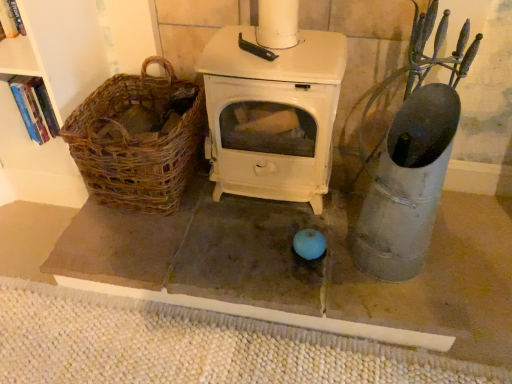
The height and width of the screenshot is (384, 512). Describe the element at coordinates (191, 346) in the screenshot. I see `woven beige mat at lower center` at that location.

What is the approximate width of woven beige mat at lower center?

1.75 meters.

Where is `woven beige mat at lower center`? woven beige mat at lower center is located at coordinates (x=191, y=346).

Describe the element at coordinates (137, 140) in the screenshot. I see `woven brown basket at left` at that location.

The height and width of the screenshot is (384, 512). I want to click on woven brown basket at left, so click(x=137, y=140).

Identify the location of woven beige mat at lower center. The width and height of the screenshot is (512, 384). (191, 346).

Is woven beige mat at lower center to the left or to the right of woven brown basket at left in the image?

From the image, it's evident that woven beige mat at lower center is to the right of woven brown basket at left.

Considering the positions of objects woven beige mat at lower center and woven brown basket at left in the image provided, who is in front, woven beige mat at lower center or woven brown basket at left?

woven beige mat at lower center.

Which is behind, point (350, 359) or point (122, 86)?

The point (122, 86) is farther.

From the image's perspective, is woven beige mat at lower center located above or below woven brown basket at left?

woven beige mat at lower center is situated lower than woven brown basket at left in the image.

From a real-world perspective, between woven beige mat at lower center and woven brown basket at left, who is vertically lower?

woven beige mat at lower center is physically lower.

Looking at their sizes, would you say woven beige mat at lower center is wider or thinner than woven brown basket at left?

In the image, woven beige mat at lower center appears to be wider than woven brown basket at left.

In terms of height, does woven beige mat at lower center look taller or shorter compared to woven brown basket at left?

Considering their sizes, woven beige mat at lower center has less height than woven brown basket at left.

Looking at the image, does woven beige mat at lower center seem bigger or smaller compared to woven brown basket at left?

Clearly, woven beige mat at lower center is smaller in size than woven brown basket at left.

Does woven beige mat at lower center contain woven brown basket at left?

Definitely not — woven brown basket at left is not inside woven beige mat at lower center.

Are woven beige mat at lower center and woven brown basket at left making contact?

They are not placed beside each other.

Is woven beige mat at lower center facing away from woven brown basket at left?

woven beige mat at lower center does not have its back to woven brown basket at left.

How different are the orientations of woven beige mat at lower center and woven brown basket at left in degrees?

The angle between the facing direction of woven beige mat at lower center and the facing direction of woven brown basket at left is 88.6 degrees.

At what (x,y) coordinates should I click in order to perform the action: click on mat below the woven brown basket at left (from a real-world perspective). Please return your answer as a coordinate pair (x, y). The width and height of the screenshot is (512, 384). Looking at the image, I should click on (191, 346).

Between woven brown basket at left and woven beige mat at lower center, which one appears on the right side from the viewer's perspective?

woven beige mat at lower center.

Consider the image. Considering their positions, is woven brown basket at left located in front of or behind woven beige mat at lower center?

Clearly, woven brown basket at left is behind woven beige mat at lower center.

Which is less distant, (113, 99) or (466, 378)?

The point (466, 378) is more forward.

From the image's perspective, which one is positioned lower, woven brown basket at left or woven beige mat at lower center?

woven beige mat at lower center, from the image's perspective.

From a real-world perspective, who is located higher, woven brown basket at left or woven beige mat at lower center?

woven brown basket at left is physically above.

Is woven brown basket at left thinner than woven beige mat at lower center?

Yes.

In terms of height, does woven brown basket at left look taller or shorter compared to woven beige mat at lower center?

In the image, woven brown basket at left appears to be taller than woven beige mat at lower center.

Between woven brown basket at left and woven beige mat at lower center, which one has larger size?

woven brown basket at left is bigger.

Is woven brown basket at left not within woven beige mat at lower center?

woven brown basket at left lies outside woven beige mat at lower center's area.

Is woven brown basket at left next to woven beige mat at lower center and touching it?

No, woven brown basket at left is not in contact with woven beige mat at lower center.

Is woven beige mat at lower center at the back of woven brown basket at left?

woven brown basket at left does not have its back to woven beige mat at lower center.

How different are the orientations of woven brown basket at left and woven beige mat at lower center in degrees?

The angular difference between woven brown basket at left and woven beige mat at lower center is 88.6 degrees.

Consider the image. Measure the distance between woven brown basket at left and woven beige mat at lower center.

They are 23.11 inches apart.

The width and height of the screenshot is (512, 384). Identify the location of mat below the woven brown basket at left (from the image's perspective). (191, 346).

I want to click on mat on the right of woven brown basket at left, so click(x=191, y=346).

Image resolution: width=512 pixels, height=384 pixels. I want to click on basket located behind the woven beige mat at lower center, so click(137, 140).